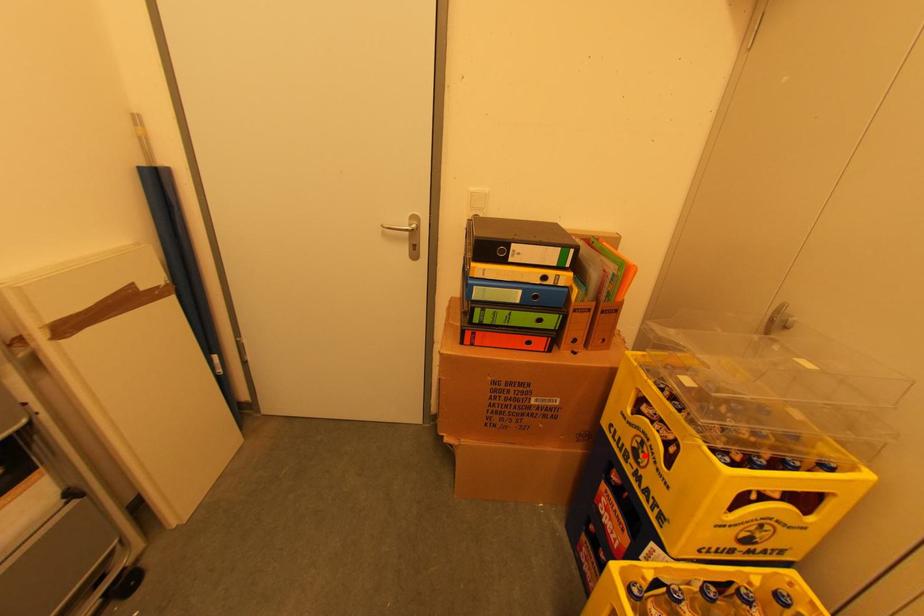
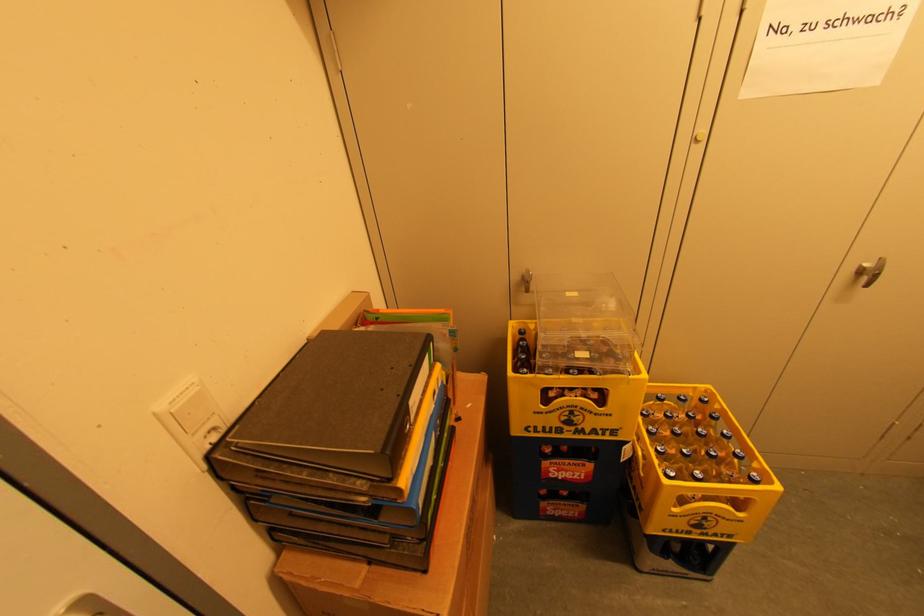
Where in the second image is the point corresponding to the highlighted location from the first image?

(578, 419)